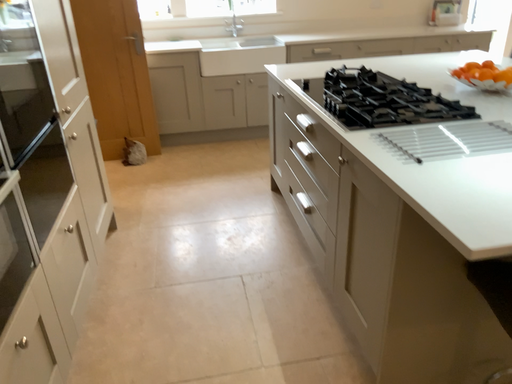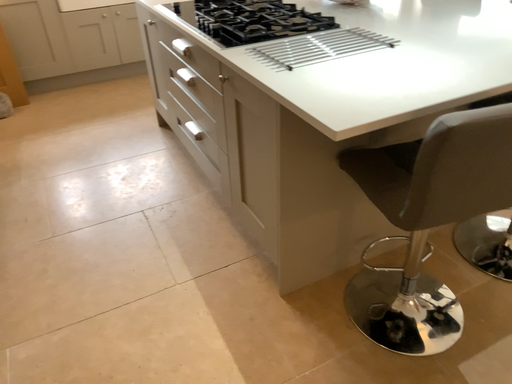
Question: How did the camera likely rotate when shooting the video?

Choices:
 (A) rotated left
 (B) rotated right

Answer: (B)